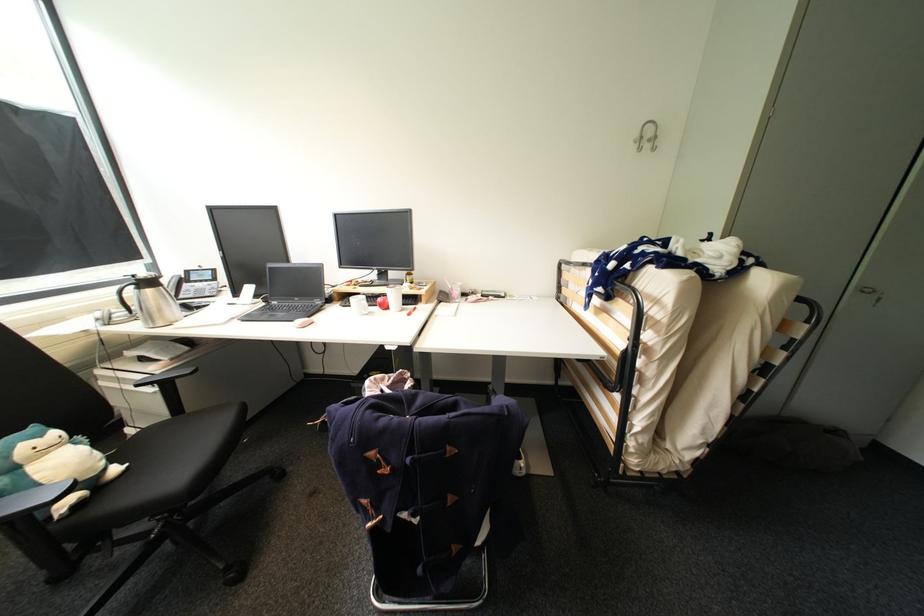
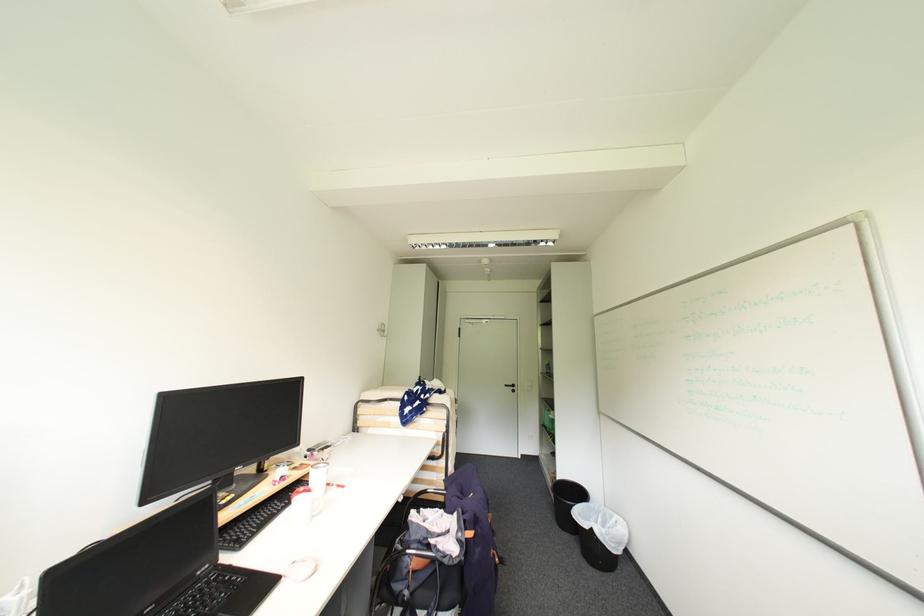
Locate, in the second image, the point that corresponds to point 394,347 in the first image.

(407, 501)